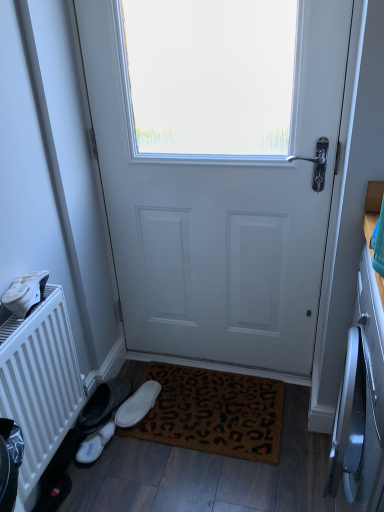
The width and height of the screenshot is (384, 512). I want to click on vacant point above brown coir doormat at lower center (from a real-world perspective), so click(210, 403).